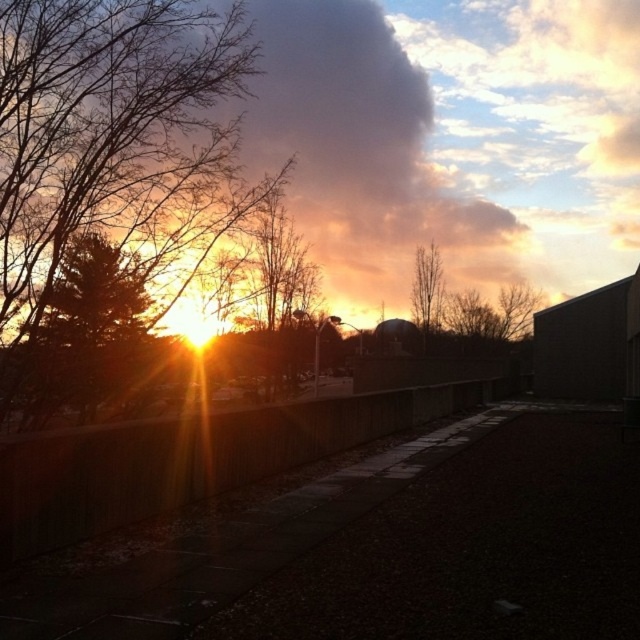
You are a bird flying over the rooftop scene. You want to land on the closest tree structure. Which one should you choose between the brown leafless branches at left and the bare wood tree at upper center?

The brown leafless branches at left are closer to your current position since they are only 47.34 meters away from the bare wood tree at upper center, so landing there would be shorter distance.